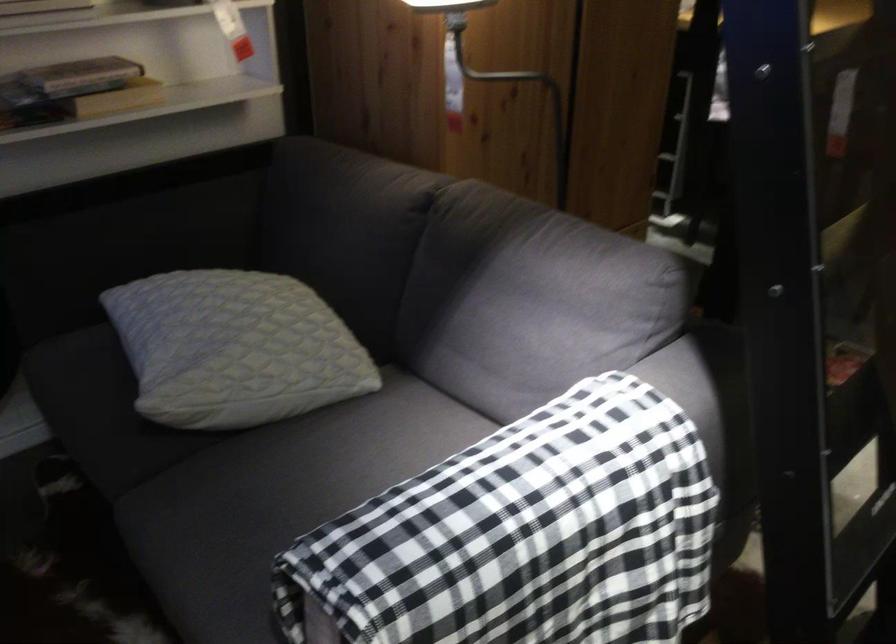
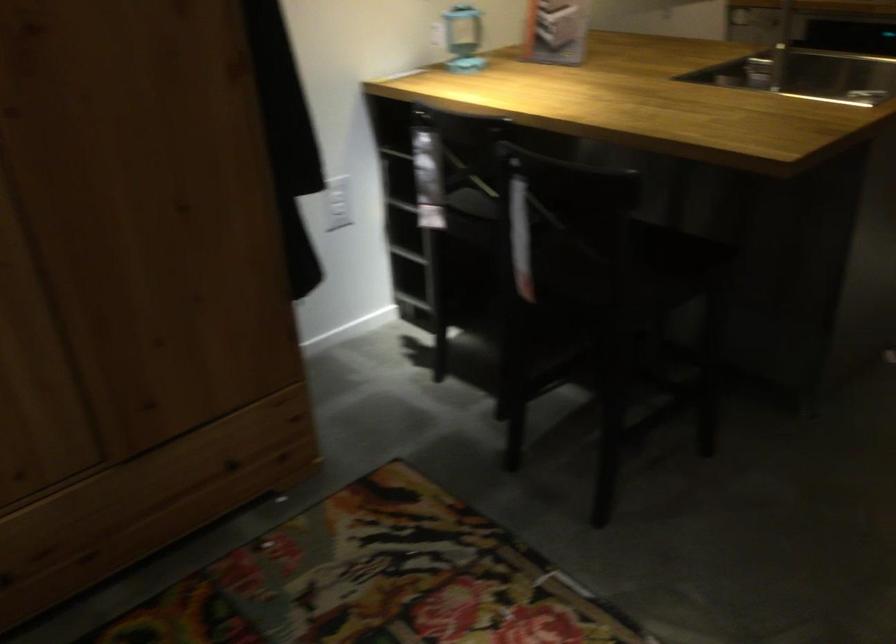
Which direction would the cameraman need to move to produce the second image?

The cameraman walked toward right, forward.